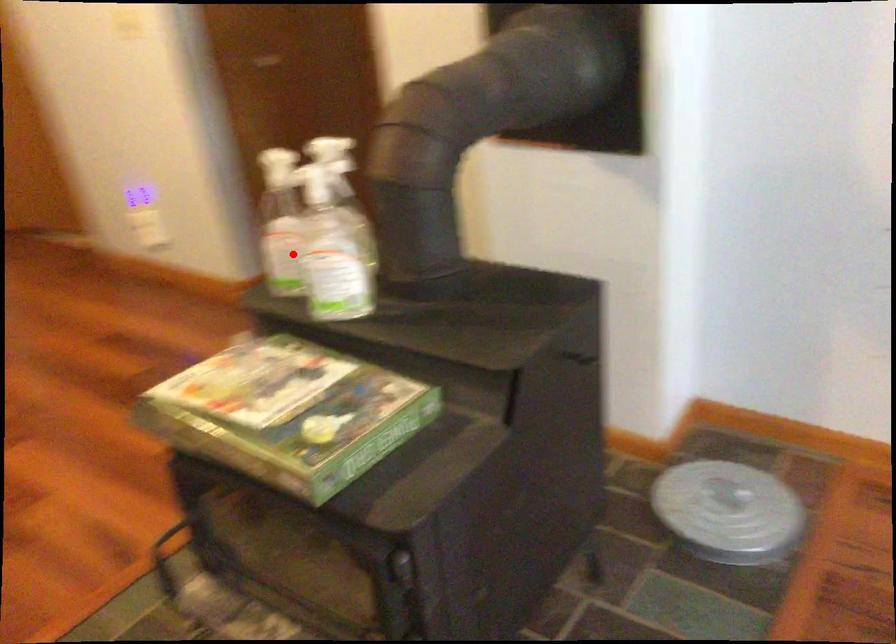
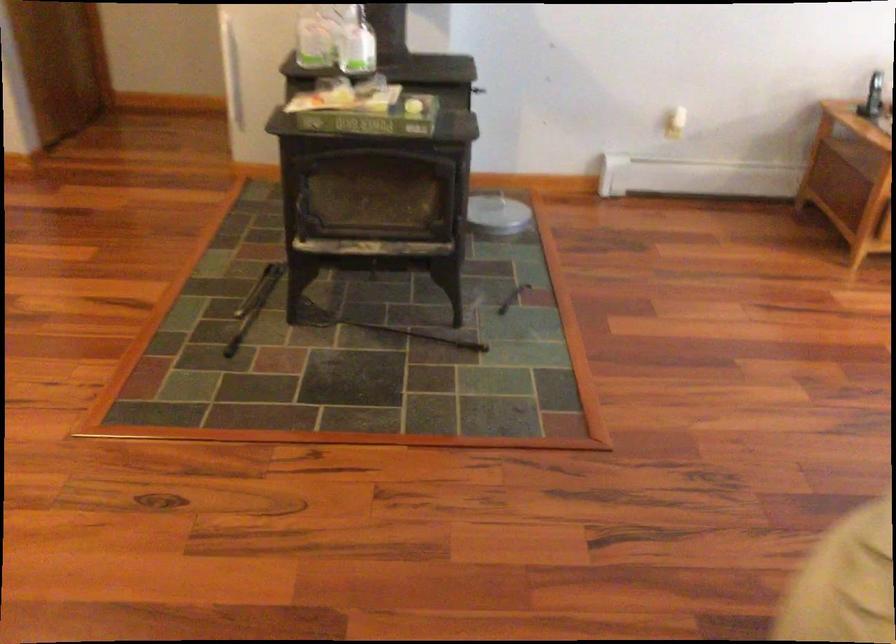
Question: I am providing you with two images of the same scene from different viewpoints. Given a red point in image1, look at the same physical point in image2. Is it:

Choices:
 (A) Closer to the viewpoint
 (B) Farther from the viewpoint

Answer: (B)